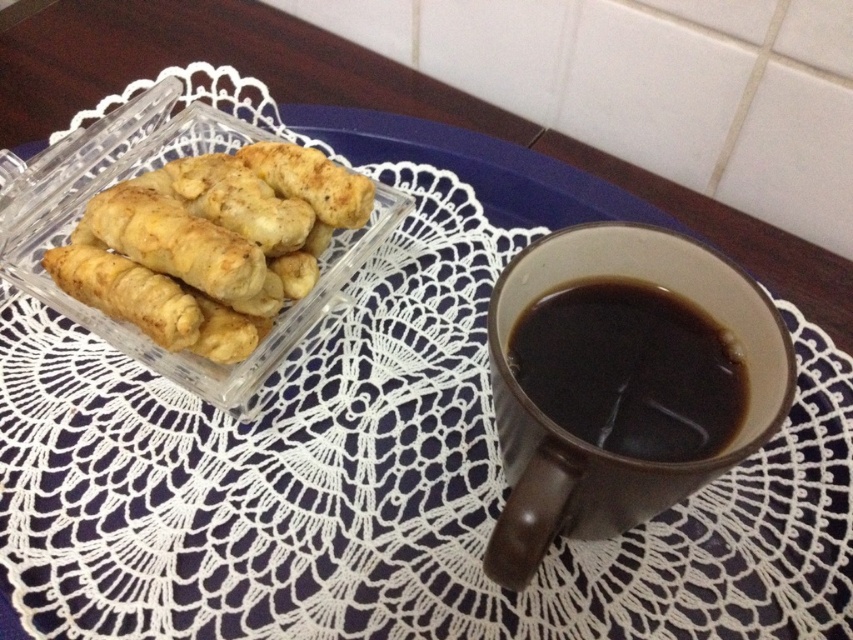
You are setting up a breakfast tray and need to place a napkin between the golden crispy pastry at left and the black matte mug at right. Based on their positions, where should you place the napkin?

The golden crispy pastry at left is positioned on the left side of the black matte mug at right, so you should place the napkin to the left of the mug, between the pastry and the mug.

You are a barista who needs to place a new coffee cup on the table without disturbing the existing setup. The table has a coordinate system where the bottom left corner is the origin. The brown ceramic mug at right is already placed at coordinate point (589, 444). Where should you place the new cup to ensure it is exactly 0.1 units to the left of the brown ceramic mug at right?

The new cup should be placed at coordinate point 0.595, 0.692 to be exactly 0.1 units to the left of the brown ceramic mug at right.

You are setting up a table for a guest and want to ensure there is enough vertical space between the golden crispy pastry at left and the black matte mug at right. If the vertical space between them needs to be at least twice the height of the taller object, is the current arrangement sufficient?

The golden crispy pastry at left is taller than the black matte mug at right. Since the required vertical space must be at least twice the height of the taller object, which is the pastry, the current arrangement may not be sufficient unless the space between them meets or exceeds twice the pastry height.